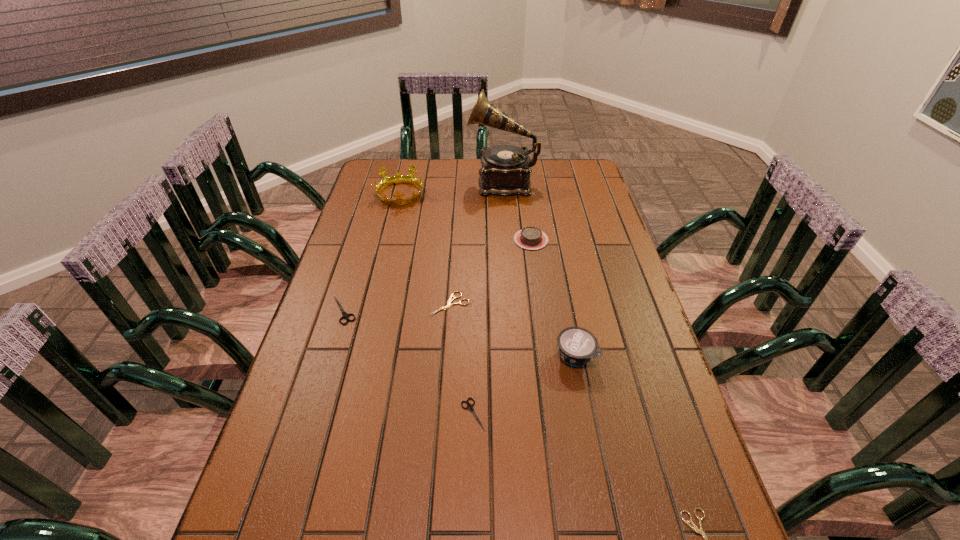
Where is `free space at the far right corner`? free space at the far right corner is located at coordinates (590, 175).

Identify the location of free space between the tallest object and the third tallest object. This screenshot has height=540, width=960. (539, 269).

I want to click on vacant area that lies between the seventh shortest object and the fifth shortest object, so click(x=466, y=217).

This screenshot has width=960, height=540. Identify the location of vacant point located between the smaller black shears and the bigger beige shears. (462, 359).

You are a GUI agent. You are given a task and a screenshot of the screen. Output one action in this format:
    pyautogui.click(x=<x>, y=<y>)
    Task: Click on the free spot between the bigger beige shears and the fifth tallest object
    
    Given the screenshot: What is the action you would take?
    pyautogui.click(x=396, y=307)

At what (x,y) coordinates should I click in order to perform the action: click on free space between the fifth shortest object and the farther black shears. Please return your answer as a coordinate pair (x, y). The image size is (960, 540). Looking at the image, I should click on (438, 275).

Locate an element on the screen. Image resolution: width=960 pixels, height=540 pixels. vacant space that's between the yogurt and the second nearest object is located at coordinates (524, 385).

Identify the location of unoccupied position between the bigger beige shears and the right black shears. Image resolution: width=960 pixels, height=540 pixels. (462, 359).

Image resolution: width=960 pixels, height=540 pixels. I want to click on the seventh closest object to the third farthest object, so click(x=700, y=531).

Identify which object is the fifth nearest to the second nearest object. Please provide its 2D coordinates. Your answer should be formatted as a tuple, i.e. [(x, y)], where the tuple contains the x and y coordinates of a point satisfying the conditions above.

[(531, 238)]